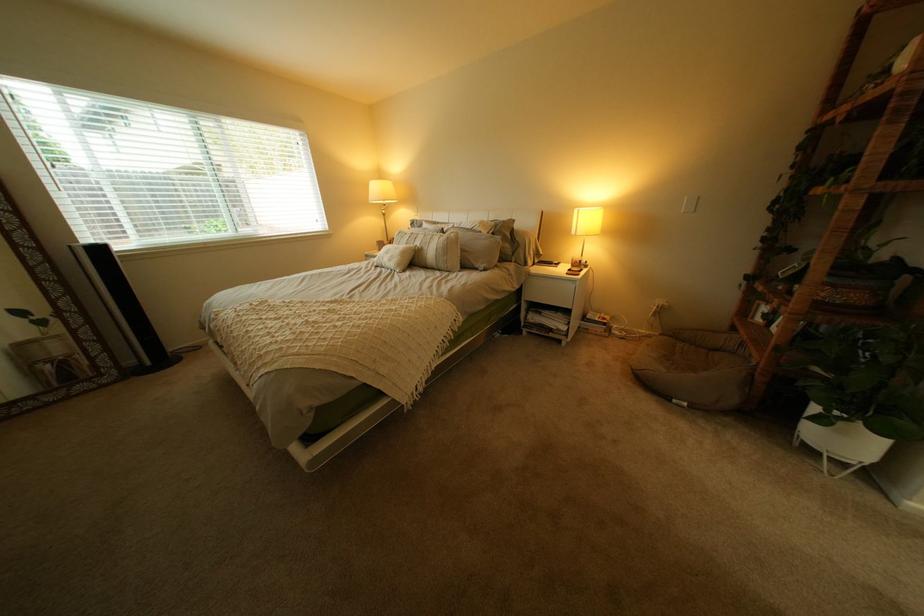
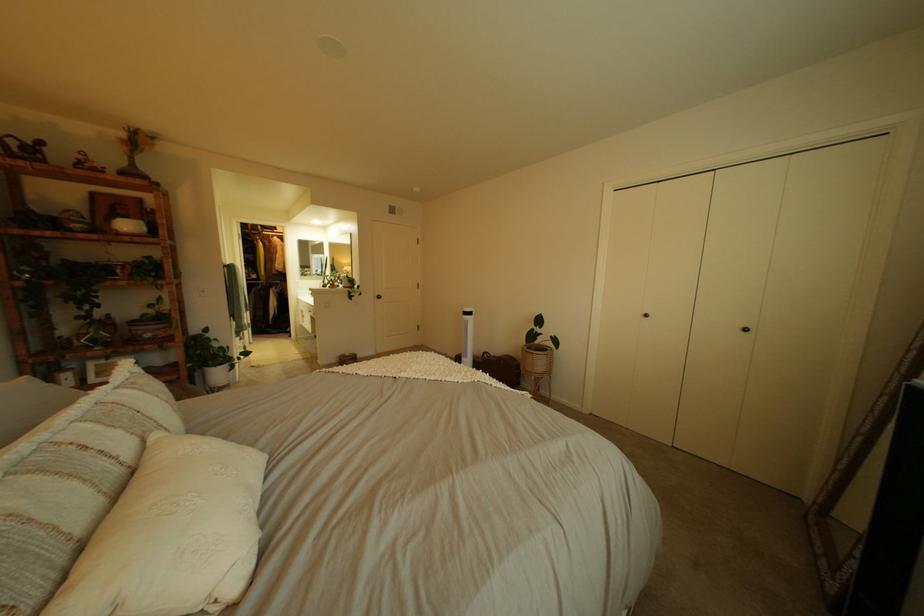
Where in the second image is the point corresponding to pixel 435 243 from the first image?

(134, 434)